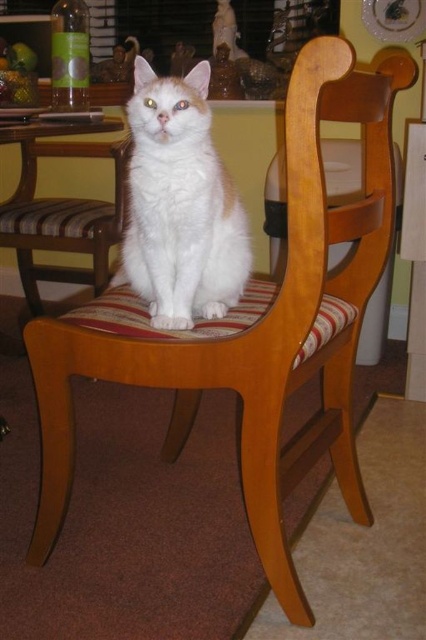
Based on the photo, you are a photographer setting up a shot of the white fluffy cat at center and the wooden chair at center. You need to adjust your focus so that both subjects are in sharp focus. Given that the cat is closer to you, which subject should you focus on to ensure both are clear?

You should focus on the wooden chair at center because the cat is closer to you, and focusing on the farther object can help keep both in focus.

You are a photographer wanting to capture the white fluffy cat at center and the wooden chair at center in a single shot. Based on their heights, which object should you focus on first if you want the cat to be in the foreground and the chair to be in the background?

The white fluffy cat at center has a lesser height compared to the wooden chair at center, so you should focus on the wooden chair at center first to ensure it appears in the background while the cat is positioned closer in the foreground.

You are taking a photo of the cat sitting on the striped cushion chair. There are two points in the image labeled as point 1 at coordinates point 1 at coordinates point (193, 250) and point 2 at coordinates point (37, 276). Which point is closer to the camera?

Point (193, 250) is closer to the camera than point (37, 276).